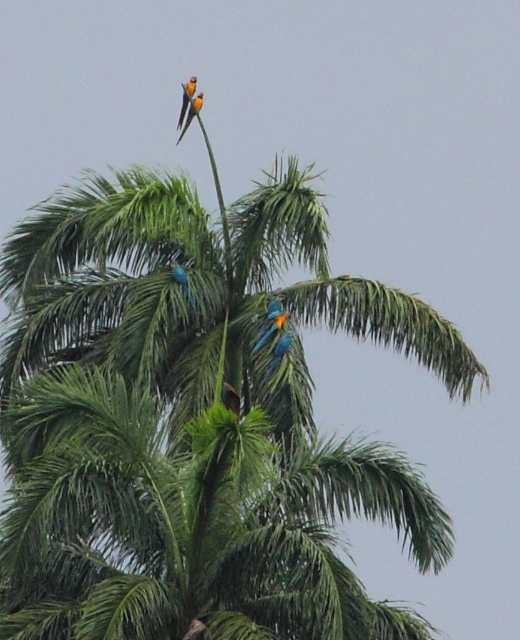
You are a birdwatcher observing the scene. You notice the green leafy coconut tree at upper center and the shiny orange bird at upper center. Which object is positioned to the right of the other?

The green leafy coconut tree at upper center is to the right of the shiny orange bird at upper center.